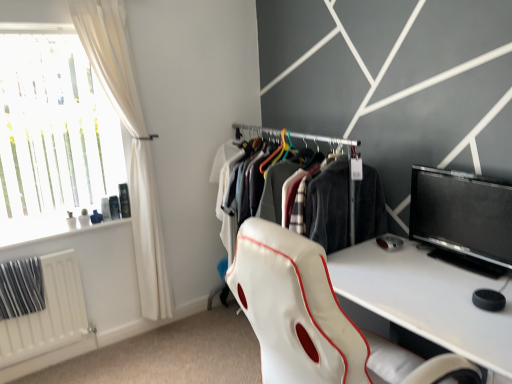
The image size is (512, 384). What do you see at coordinates (132, 143) in the screenshot? I see `white fabric curtain at left` at bounding box center [132, 143].

What do you see at coordinates (312, 190) in the screenshot?
I see `white fabric closet at center` at bounding box center [312, 190].

Where is `black glossy monitor at right`? black glossy monitor at right is located at coordinates coord(463,218).

This screenshot has height=384, width=512. What are the coordinates of `white fabric curtain at left` in the screenshot? It's located at (132, 143).

Between white matte radiator at lower left and white leather chair at center, which one appears on the right side from the viewer's perspective?

From the viewer's perspective, white leather chair at center appears more on the right side.

From a real-world perspective, relative to white leather chair at center, is white matte radiator at lower left vertically above or below?

In terms of real-world spatial position, white matte radiator at lower left is below white leather chair at center.

From the image's perspective, is white matte radiator at lower left located beneath white leather chair at center?

Correct, white matte radiator at lower left appears lower than white leather chair at center in the image.

Considering the points (33, 339) and (288, 333), which point is behind, point (33, 339) or point (288, 333)?

Positioned behind is point (33, 339).

Consider the image. Does white fabric closet at center have a smaller size compared to white matte radiator at lower left?

No, white fabric closet at center is not smaller than white matte radiator at lower left.

Is white fabric closet at center far away from white matte radiator at lower left?

white fabric closet at center is positioned a significant distance from white matte radiator at lower left.

In the scene shown: Is white fabric closet at center not within white matte radiator at lower left?

white fabric closet at center is positioned outside white matte radiator at lower left.

At what (x,y) coordinates should I click in order to perform the action: click on radiator that is under the white fabric closet at center (from a real-world perspective). Please return your answer as a coordinate pair (x, y). The height and width of the screenshot is (384, 512). Looking at the image, I should click on (47, 321).

Based on the photo, is white fabric curtain at left outside of black glossy monitor at right?

Indeed, white fabric curtain at left is completely outside black glossy monitor at right.

Is white fabric curtain at left positioned far away from black glossy monitor at right?

Yes, white fabric curtain at left is far from black glossy monitor at right.

The width and height of the screenshot is (512, 384). Find the location of `curtain behind the black glossy monitor at right`. curtain behind the black glossy monitor at right is located at coordinates (132, 143).

Which object is positioned more to the right, white matte radiator at lower left or black glossy monitor at right?

black glossy monitor at right is more to the right.

Relative to black glossy monitor at right, is white matte radiator at lower left in front or behind?

white matte radiator at lower left is behind black glossy monitor at right.

Can you confirm if white matte radiator at lower left is thinner than black glossy monitor at right?

Yes, white matte radiator at lower left is thinner than black glossy monitor at right.

From the image's perspective, does white matte radiator at lower left appear lower than black glossy monitor at right?

Correct, white matte radiator at lower left appears lower than black glossy monitor at right in the image.

Considering the relative sizes of white leather chair at center and white fabric curtain at left in the image provided, is white leather chair at center taller than white fabric curtain at left?

No, white leather chair at center is not taller than white fabric curtain at left.

Considering the positions of objects white leather chair at center and white fabric curtain at left in the image provided, who is more to the right, white leather chair at center or white fabric curtain at left?

From the viewer's perspective, white leather chair at center appears more on the right side.

Can you confirm if white leather chair at center is wider than white fabric curtain at left?

Correct, the width of white leather chair at center exceeds that of white fabric curtain at left.

Who is smaller, white leather chair at center or white fabric curtain at left?

Smaller between the two is white fabric curtain at left.

Considering the sizes of black glossy monitor at right and white matte radiator at lower left in the image, is black glossy monitor at right taller or shorter than white matte radiator at lower left?

In the image, black glossy monitor at right appears to be shorter than white matte radiator at lower left.

Between black glossy monitor at right and white matte radiator at lower left, which one appears on the left side from the viewer's perspective?

white matte radiator at lower left is more to the left.

Can you tell me how much black glossy monitor at right and white matte radiator at lower left differ in facing direction?

91.7 degrees separate the facing orientations of black glossy monitor at right and white matte radiator at lower left.

Locate an element on the screen. This screenshot has height=384, width=512. radiator on the left of black glossy monitor at right is located at coordinates point(47,321).

Is translucent glass window at upper left next to black glossy monitor at right?

There is a gap between translucent glass window at upper left and black glossy monitor at right.

Does translucent glass window at upper left turn towards black glossy monitor at right?

No, translucent glass window at upper left is not facing towards black glossy monitor at right.

This screenshot has height=384, width=512. Find the location of `window to the left of black glossy monitor at right`. window to the left of black glossy monitor at right is located at coordinates (52, 133).

Locate an element on the screen. Image resolution: width=512 pixels, height=384 pixels. radiator that appears below the white leather chair at center (from the image's perspective) is located at coordinates (47, 321).

In the image, there is a white matte radiator at lower left. Find the location of `closet above it (from the image's perspective)`. closet above it (from the image's perspective) is located at coordinates (312, 190).

Looking at this image, when comparing their distances from white matte radiator at lower left, does translucent glass window at upper left or black glossy monitor at right seem further?

Based on the image, black glossy monitor at right appears to be further to white matte radiator at lower left.

Based on their spatial positions, is translucent glass window at upper left or white leather chair at center closer to white fabric closet at center?

white leather chair at center is closer to white fabric closet at center.

Which object lies further to the anchor point white fabric curtain at left, translucent glass window at upper left or black glossy monitor at right?

black glossy monitor at right lies further to white fabric curtain at left than the other object.

Looking at the image, which one is located further to white leather chair at center, white matte radiator at lower left or black glossy monitor at right?

white matte radiator at lower left is positioned further to the anchor white leather chair at center.

Based on the photo, considering their positions, is white fabric closet at center positioned further to translucent glass window at upper left than white leather chair at center?

white leather chair at center.

Based on their spatial positions, is white matte radiator at lower left or white fabric closet at center closer to translucent glass window at upper left?

white matte radiator at lower left is positioned closer to the anchor translucent glass window at upper left.

Based on their spatial positions, is translucent glass window at upper left or black glossy monitor at right closer to white leather chair at center?

black glossy monitor at right is positioned closer to the anchor white leather chair at center.

Estimate the real-world distances between objects in this image. Which object is closer to white fabric curtain at left, white fabric closet at center or translucent glass window at upper left?

translucent glass window at upper left is positioned closer to the anchor white fabric curtain at left.

Find the location of a particular element. This screenshot has width=512, height=384. closet between white leather chair at center and white fabric curtain at left in the front-back direction is located at coordinates (312, 190).

The image size is (512, 384). In order to click on curtain between translucent glass window at upper left and black glossy monitor at right in this screenshot , I will do `click(132, 143)`.

Find the location of a particular element. chair located between white matte radiator at lower left and black glossy monitor at right in the left-right direction is located at coordinates (316, 319).

Identify the location of closet between translucent glass window at upper left and white leather chair at center. (312, 190).